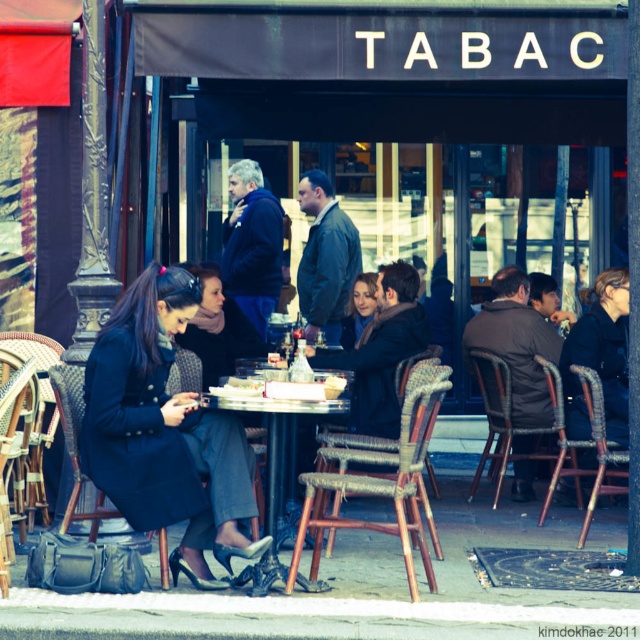
Question: Is matte black coat at left above wooden table at center?

Choices:
 (A) yes
 (B) no

Answer: (A)

Question: Which point appears closest to the camera in this image?

Choices:
 (A) (321, 589)
 (B) (166, 444)

Answer: (B)

Question: Which of the following is the closest to the observer?

Choices:
 (A) matte black coat at left
 (B) wooden table at center
 (C) matte black coat at center

Answer: (A)

Question: Which of the following is the farthest from the observer?

Choices:
 (A) (276, 438)
 (B) (368, 298)
 (C) (161, 284)

Answer: (B)

Question: Is matte black coat at left below wooden table at center?

Choices:
 (A) no
 (B) yes

Answer: (A)

Question: Where is matte black coat at left located in relation to wooden table at center in the image?

Choices:
 (A) below
 (B) above

Answer: (B)